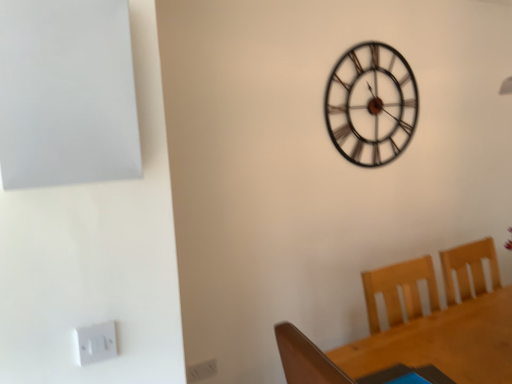
In order to face white plastic electric outlet at lower left, should I rotate leftwards or rightwards?

Turn left by 19.928 degrees to look at white plastic electric outlet at lower left.

This screenshot has width=512, height=384. In order to click on wooden table at lower right in this screenshot , I will do `click(443, 342)`.

The width and height of the screenshot is (512, 384). Describe the element at coordinates (443, 342) in the screenshot. I see `wooden table at lower right` at that location.

This screenshot has width=512, height=384. What are the coordinates of `white plastic electric outlet at lower left` in the screenshot? It's located at point(95,342).

Where is `electric outlet below the metallic black clock at upper center (from the image's perspective)`? The image size is (512, 384). electric outlet below the metallic black clock at upper center (from the image's perspective) is located at coordinates (95, 342).

Considering the relative sizes of white plastic electric outlet at lower left and metallic black clock at upper center in the image provided, is white plastic electric outlet at lower left taller than metallic black clock at upper center?

No.

Is white plastic electric outlet at lower left completely or partially outside of metallic black clock at upper center?

white plastic electric outlet at lower left lies outside metallic black clock at upper center's area.

Which point is more forward, (100, 343) or (502, 365)?

The point (100, 343) is more forward.

Between white plastic electric outlet at lower left and wooden table at lower right, which one has larger size?

With larger size is wooden table at lower right.

Can you confirm if white plastic electric outlet at lower left is shorter than wooden table at lower right?

Yes, white plastic electric outlet at lower left is shorter than wooden table at lower right.

The height and width of the screenshot is (384, 512). I want to click on electric outlet located below the metallic black clock at upper center (from the image's perspective), so click(x=95, y=342).

From a real-world perspective, which is physically below, metallic black clock at upper center or white plastic electric outlet at lower left?

white plastic electric outlet at lower left, from a real-world perspective.

Considering the points (348, 84) and (79, 328), which point is behind, point (348, 84) or point (79, 328)?

Positioned behind is point (348, 84).

Is metallic black clock at upper center completely or partially outside of white plastic electric outlet at lower left?

Absolutely, metallic black clock at upper center is external to white plastic electric outlet at lower left.

Measure the distance from wooden table at lower right to metallic black clock at upper center.

wooden table at lower right and metallic black clock at upper center are 1.12 meters apart from each other.

Where is `round table in front of the metallic black clock at upper center`? Image resolution: width=512 pixels, height=384 pixels. round table in front of the metallic black clock at upper center is located at coordinates (443, 342).

Is wooden table at lower right positioned in front of metallic black clock at upper center?

Yes, it is.

Between wooden table at lower right and metallic black clock at upper center, which one appears on the left side from the viewer's perspective?

metallic black clock at upper center is more to the left.

Find the location of a particular element. The width and height of the screenshot is (512, 384). round table located underneath the white plastic electric outlet at lower left (from a real-world perspective) is located at coordinates (443, 342).

Is point (419, 343) positioned after point (102, 334)?

Yes.

Can you tell me how much wooden table at lower right and white plastic electric outlet at lower left differ in facing direction?

0.051 degrees.

Consider the image. From a real-world perspective, is wooden table at lower right located higher than white plastic electric outlet at lower left?

No, from a real-world perspective, wooden table at lower right is not above white plastic electric outlet at lower left.

Between metallic black clock at upper center and wooden table at lower right, which one appears on the left side from the viewer's perspective?

metallic black clock at upper center is more to the left.

Is metallic black clock at upper center directly adjacent to wooden table at lower right?

There is a gap between metallic black clock at upper center and wooden table at lower right.

Considering the sizes of objects metallic black clock at upper center and wooden table at lower right in the image provided, who is taller, metallic black clock at upper center or wooden table at lower right?

With more height is metallic black clock at upper center.

Consider the image. Is metallic black clock at upper center oriented away from wooden table at lower right?

metallic black clock at upper center is not turned away from wooden table at lower right.

The image size is (512, 384). In order to click on electric outlet in front of the metallic black clock at upper center in this screenshot , I will do coord(95,342).

Find the location of a particular element. electric outlet on the left side of wooden table at lower right is located at coordinates (95, 342).

From the image, which object appears to be farther from white plastic electric outlet at lower left, metallic black clock at upper center or wooden table at lower right?

metallic black clock at upper center is further to white plastic electric outlet at lower left.

When comparing their distances from white plastic electric outlet at lower left, does wooden table at lower right or metallic black clock at upper center seem further?

metallic black clock at upper center is positioned further to the anchor white plastic electric outlet at lower left.

When comparing their distances from metallic black clock at upper center, does wooden table at lower right or white plastic electric outlet at lower left seem further?

Based on the image, white plastic electric outlet at lower left appears to be further to metallic black clock at upper center.

Based on their spatial positions, is metallic black clock at upper center or white plastic electric outlet at lower left further from wooden table at lower right?

Among the two, white plastic electric outlet at lower left is located further to wooden table at lower right.

Considering their positions, is white plastic electric outlet at lower left positioned further to metallic black clock at upper center than wooden table at lower right?

white plastic electric outlet at lower left is positioned further to the anchor metallic black clock at upper center.

From the picture: Estimate the real-world distances between objects in this image. Which object is further from wooden table at lower right, white plastic electric outlet at lower left or metallic black clock at upper center?

The object further to wooden table at lower right is white plastic electric outlet at lower left.

Find the location of `wall clock situated between white plastic electric outlet at lower left and wooden table at lower right from left to right`. wall clock situated between white plastic electric outlet at lower left and wooden table at lower right from left to right is located at coordinates (371, 104).